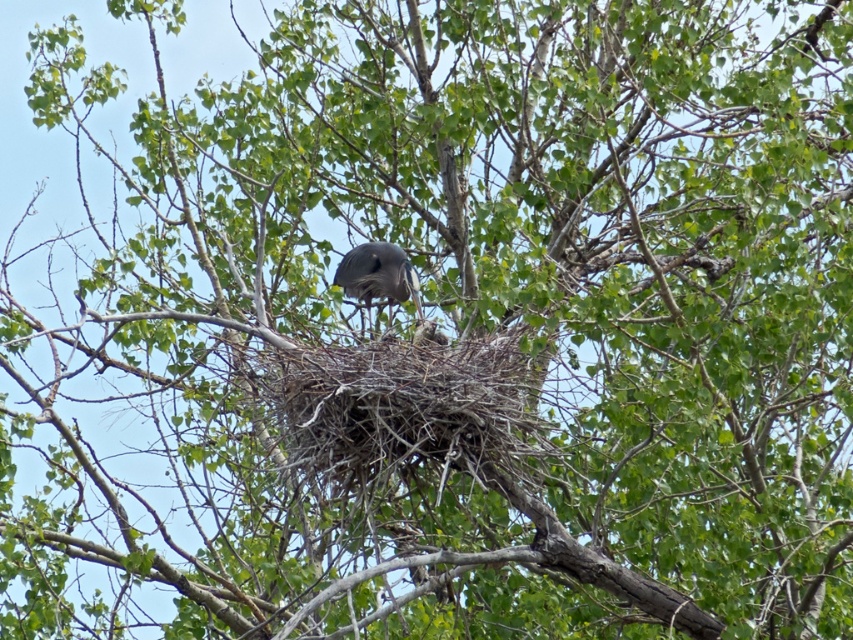
You are a birdwatcher observing the tree from below. You notice the dark gray nest at center and the gray matte bird at center. Which one is positioned to the right side of the other?

The dark gray nest at center is to the right of the gray matte bird at center.

You are a birdwatcher observing the tree from below. There is a dark gray nest at center located at point (408, 406). Can you see the two young birds inside the dark gray nest at center from your vantage point?

The dark gray nest at center is located at point (408, 406). Since the adult bird is perched above them, it might block your view of the two young birds inside the dark gray nest at center.

You are a birdwatcher observing the scene. You notice the dark gray nest at center and the gray matte bird at center. Based on their positions, which one is closer to you?

The dark gray nest at center is closer to you because it is in front of the gray matte bird at center.